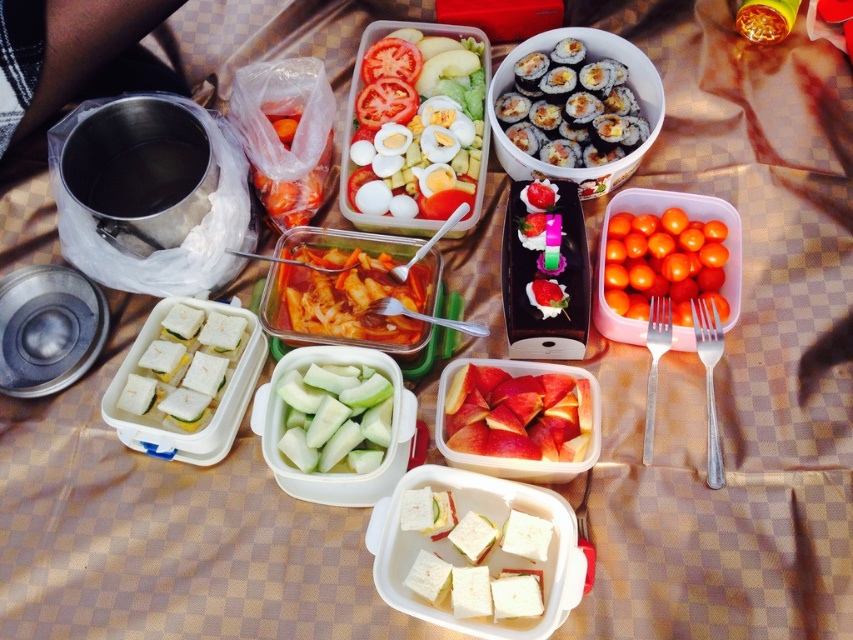
You are planning to pack a lunchbox that has a width of 15 cm. You have a white bread sandwich at center and pink matte apple slices at center. Which item will fit better in the lunchbox if the sandwich is narrower than the apple slices?

The white bread sandwich at center will fit better in the lunchbox since its width is less than the pink matte apple slices at center, making it narrower and more suitable for the 15 cm width.

You are organizing a picnic and need to stack the pink matte apple slices at center and the green matte cucumber at center vertically. Which one should you place at the bottom to ensure stability?

You should place the green matte cucumber at center at the bottom since it is taller than the pink matte apple slices at center, providing a stable base.

You are planning to grab a snack from the picnic setup. You see the white sandwich at center and the green matte cucumber at center. Which one is located higher up?

The white sandwich at center is above the green matte cucumber at center, so it is located higher up.